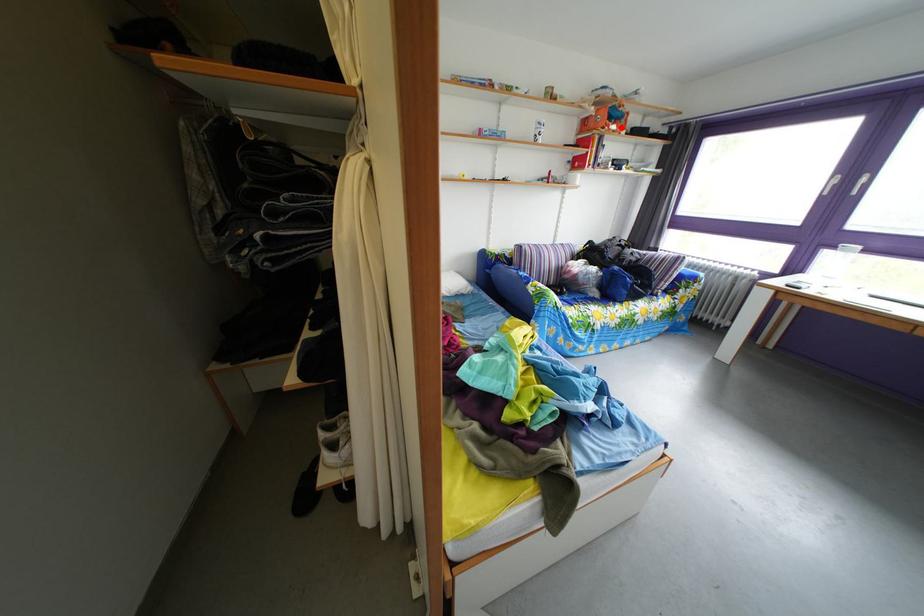
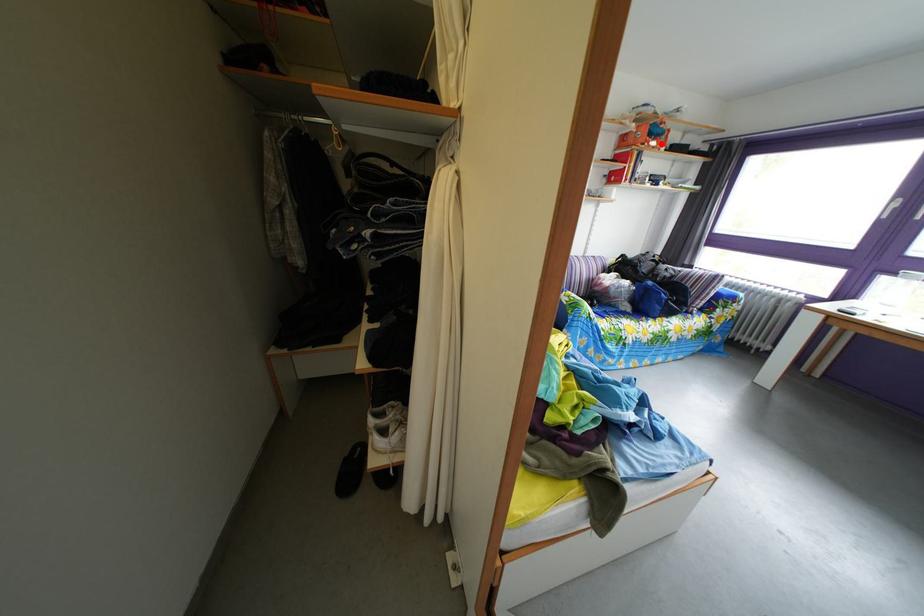
I am providing you with two images of the same scene from different viewpoints. A red point is marked on the first image and another point is marked on the second image. Is the marked point in image1 the same physical position as the marked point in image2?

Yes